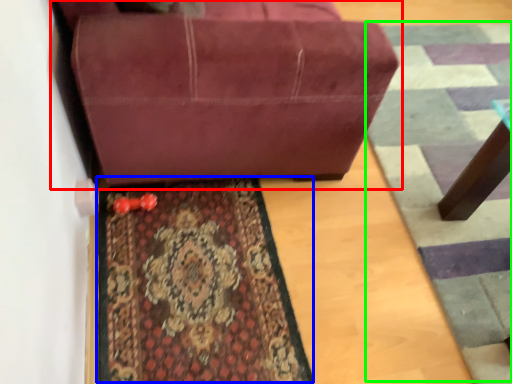
Question: Considering the real-world distances, which object is farthest from studio couch (highlighted by a red box)? mat (highlighted by a blue box) or doormat (highlighted by a green box)?

Choices:
 (A) mat
 (B) doormat

Answer: (B)